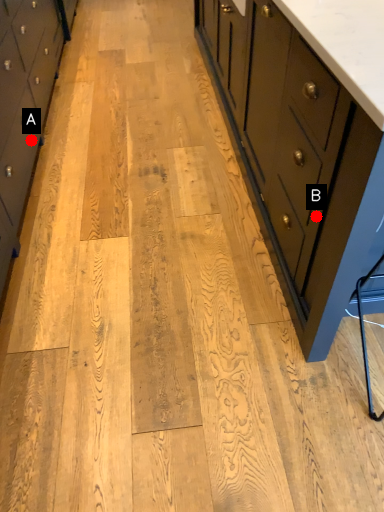
Question: Two points are circled on the image, labeled by A and B beside each circle. Which point is farther from the camera taking this photo?

Choices:
 (A) A is further
 (B) B is further

Answer: (A)